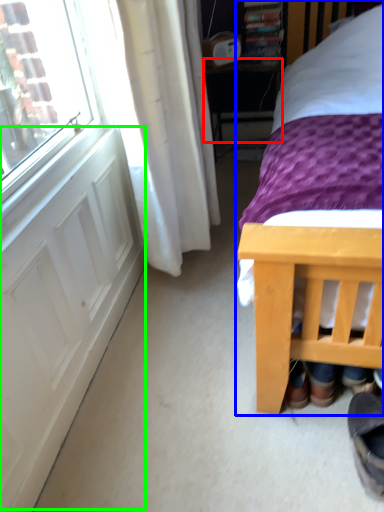
Question: Estimate the real-world distances between objects in this image. Which object is closer to table (highlighted by a red box), bed (highlighted by a blue box) or screen door (highlighted by a green box)?

Choices:
 (A) bed
 (B) screen door

Answer: (B)